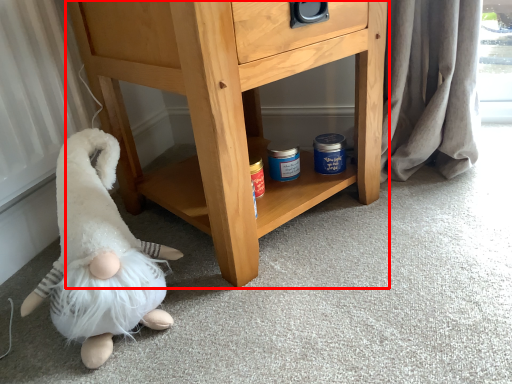
Question: In this image, where is chest of drawers (annotated by the red box) located relative to toy?

Choices:
 (A) right
 (B) left

Answer: (A)